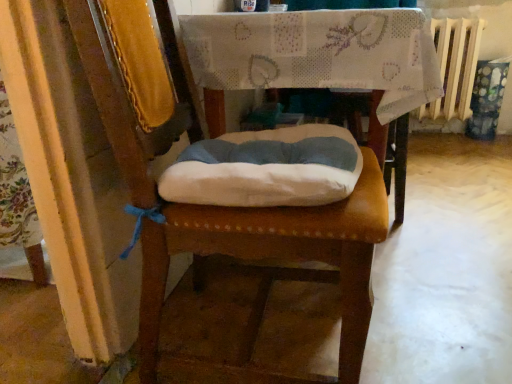
Question: Considering the relative positions of leather cushion at center and fabric-covered table at center in the image provided, is leather cushion at center to the right of fabric-covered table at center from the viewer's perspective?

Choices:
 (A) yes
 (B) no

Answer: (B)

Question: Is leather cushion at center oriented towards fabric-covered table at center?

Choices:
 (A) no
 (B) yes

Answer: (A)

Question: Considering the relative sizes of leather cushion at center and fabric-covered table at center in the image provided, is leather cushion at center shorter than fabric-covered table at center?

Choices:
 (A) no
 (B) yes

Answer: (A)

Question: Does leather cushion at center contain fabric-covered table at center?

Choices:
 (A) no
 (B) yes

Answer: (A)

Question: Would you say leather cushion at center is a long distance from fabric-covered table at center?

Choices:
 (A) yes
 (B) no

Answer: (B)

Question: From the image's perspective, is leather cushion at center above or below white painted metal radiator at upper right?

Choices:
 (A) above
 (B) below

Answer: (B)

Question: Is leather cushion at center inside or outside of white painted metal radiator at upper right?

Choices:
 (A) outside
 (B) inside

Answer: (A)

Question: Would you say leather cushion at center is to the left or to the right of white painted metal radiator at upper right in the picture?

Choices:
 (A) left
 (B) right

Answer: (A)

Question: Considering the positions of leather cushion at center and white painted metal radiator at upper right in the image, is leather cushion at center taller or shorter than white painted metal radiator at upper right?

Choices:
 (A) short
 (B) tall

Answer: (B)

Question: Looking at their shapes, would you say fabric-covered table at center is wider or thinner than leather cushion at center?

Choices:
 (A) wide
 (B) thin

Answer: (A)

Question: Considering the relative positions of fabric-covered table at center and leather cushion at center in the image provided, is fabric-covered table at center to the left or to the right of leather cushion at center?

Choices:
 (A) right
 (B) left

Answer: (A)

Question: In terms of size, does fabric-covered table at center appear bigger or smaller than leather cushion at center?

Choices:
 (A) small
 (B) big

Answer: (B)

Question: In terms of height, does fabric-covered table at center look taller or shorter compared to leather cushion at center?

Choices:
 (A) tall
 (B) short

Answer: (B)

Question: From a real-world perspective, is leather cushion at center positioned above or below fabric-covered table at center?

Choices:
 (A) above
 (B) below

Answer: (A)

Question: Looking at their shapes, would you say leather cushion at center is wider or thinner than fabric-covered table at center?

Choices:
 (A) wide
 (B) thin

Answer: (B)